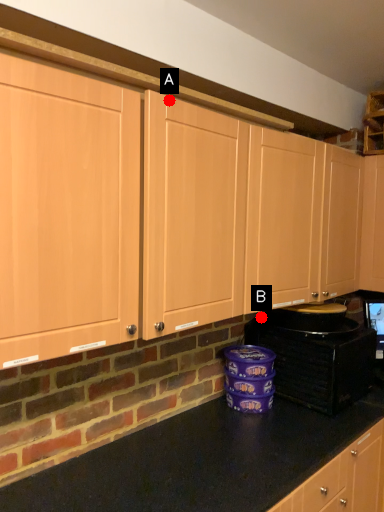
Question: Two points are circled on the image, labeled by A and B beside each circle. Which point appears closest to the camera in this image?

Choices:
 (A) A is closer
 (B) B is closer

Answer: (A)